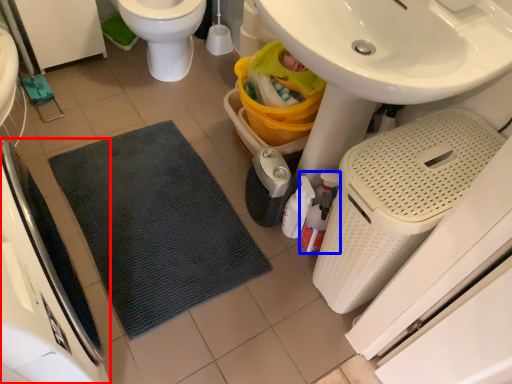
Question: Which object appears closest to the camera in this image, appliance (highlighted by a red box) or cleaning product (highlighted by a blue box)?

Choices:
 (A) appliance
 (B) cleaning product

Answer: (A)